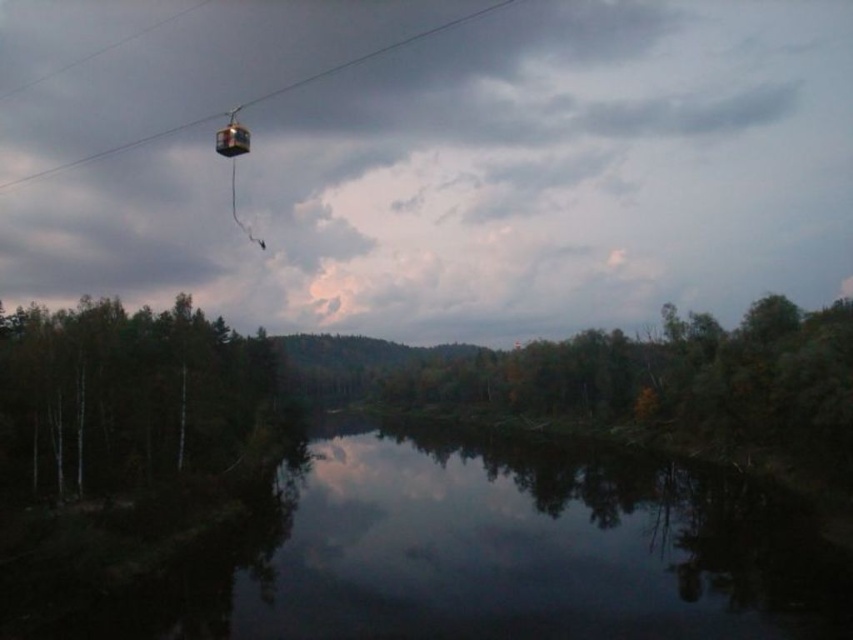
Between point (219, 451) and point (335, 68), which one is positioned in front?

Point (219, 451) is in front.

Which is more to the right, green matte tree at left or metal cable car at upper center?

From the viewer's perspective, green matte tree at left appears more on the right side.

This screenshot has width=853, height=640. What do you see at coordinates (126, 396) in the screenshot?
I see `green matte tree at left` at bounding box center [126, 396].

Where is `green matte tree at left`? green matte tree at left is located at coordinates (126, 396).